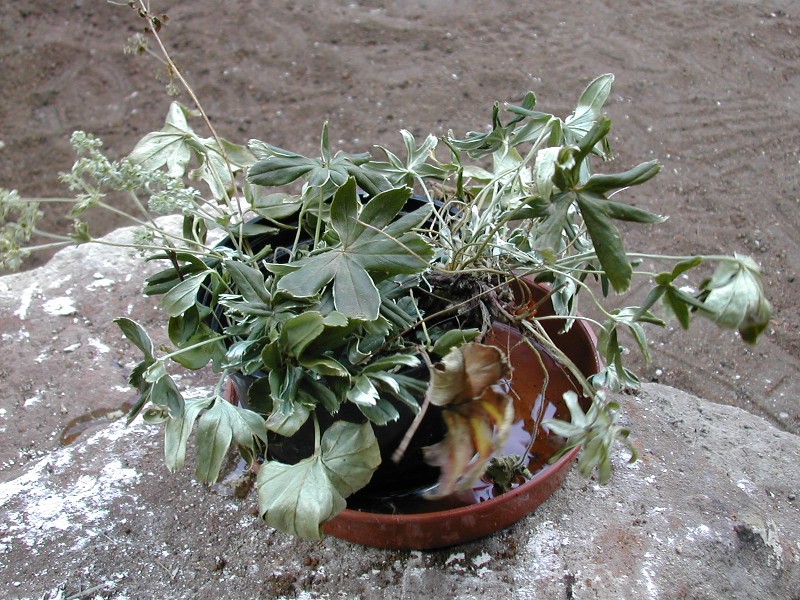
You are a GUI agent. You are given a task and a screenshot of the screen. Output one action in this format:
    pyautogui.click(x=<x>, y=<y>)
    Task: Click on the water in planter
    
    Given the screenshot: What is the action you would take?
    pyautogui.click(x=522, y=438)